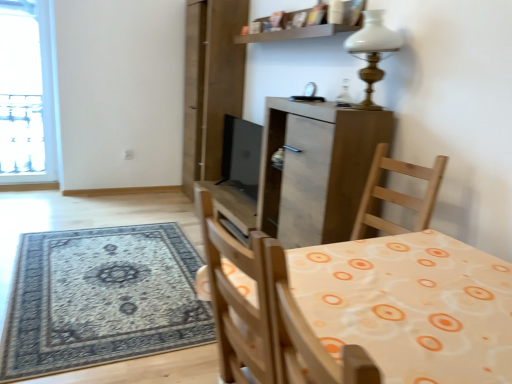
What do you see at coordinates (372, 51) in the screenshot? I see `white glass lamp at upper center` at bounding box center [372, 51].

I want to click on matte wood cabinet at center, so click(x=316, y=169).

This screenshot has height=384, width=512. Describe the element at coordinates (295, 33) in the screenshot. I see `wooden shelf at upper center` at that location.

Image resolution: width=512 pixels, height=384 pixels. I want to click on wooden table at center, so click(x=410, y=306).

In the scene shown: Is matte wood cabinet at center completely or partially outside of black matte screen door at upper center?

Yes, matte wood cabinet at center is located beyond the bounds of black matte screen door at upper center.

Would you say matte wood cabinet at center is to the left or to the right of black matte screen door at upper center in the picture?

From the image, it's evident that matte wood cabinet at center is to the right of black matte screen door at upper center.

Considering their positions, is matte wood cabinet at center located in front of or behind black matte screen door at upper center?

Visually, matte wood cabinet at center is located in front of black matte screen door at upper center.

Considering the relative sizes of matte wood cabinet at center and black matte screen door at upper center in the image provided, is matte wood cabinet at center taller than black matte screen door at upper center?

In fact, matte wood cabinet at center may be shorter than black matte screen door at upper center.

From the image's perspective, between wooden shelf at upper center and matte wood cabinet at center, which one is located above?

wooden shelf at upper center appears higher in the image.

Is wooden shelf at upper center turned away from matte wood cabinet at center?

wooden shelf at upper center does not have its back to matte wood cabinet at center.

Considering the relative sizes of wooden shelf at upper center and matte wood cabinet at center in the image provided, is wooden shelf at upper center bigger than matte wood cabinet at center?

No.

Does point (278, 31) come closer to viewer compared to point (342, 192)?

No, it is not.

Can you confirm if black matte screen door at upper center is thinner than wooden table at center?

Indeed, black matte screen door at upper center has a lesser width compared to wooden table at center.

Does black matte screen door at upper center turn towards wooden table at center?

No, black matte screen door at upper center is not turned towards wooden table at center.

Which object is further away from the camera, black matte screen door at upper center or wooden table at center?

black matte screen door at upper center is further away from the camera.

Is black matte screen door at upper center to the left of wooden table at center from the viewer's perspective?

Correct, you'll find black matte screen door at upper center to the left of wooden table at center.

What's the angular difference between matte wood cabinet at center and wooden table at center's facing directions?

matte wood cabinet at center and wooden table at center are facing 178 degrees away from each other.

Which object is further away from the camera taking this photo, matte wood cabinet at center or wooden table at center?

matte wood cabinet at center is further away from the camera.

From a real-world perspective, is matte wood cabinet at center positioned over wooden table at center based on gravity?

No.

Which of these two, matte wood cabinet at center or wooden table at center, is bigger?

With larger size is matte wood cabinet at center.

Looking at this image, how many degrees apart are the facing directions of black matte screen door at upper center and matte wood cabinet at center?

There is a 0.000172-degree angle between the facing directions of black matte screen door at upper center and matte wood cabinet at center.

Consider the image. Is black matte screen door at upper center not near matte wood cabinet at center?

Yes, black matte screen door at upper center and matte wood cabinet at center are quite far apart.

Is black matte screen door at upper center shorter than matte wood cabinet at center?

No, black matte screen door at upper center is not shorter than matte wood cabinet at center.

Considering the positions of objects black matte screen door at upper center and matte wood cabinet at center in the image provided, who is more to the left, black matte screen door at upper center or matte wood cabinet at center?

From the viewer's perspective, black matte screen door at upper center appears more on the left side.

Does wooden table at center turn towards black matte screen door at upper center?

No.

Where is `screen door above the wooden table at center (from a real-world perspective)`? This screenshot has width=512, height=384. screen door above the wooden table at center (from a real-world perspective) is located at coordinates (211, 84).

From the image's perspective, is wooden table at center located beneath black matte screen door at upper center?

Yes, from the image's perspective, wooden table at center is below black matte screen door at upper center.

Which object is wider, wooden table at center or black matte screen door at upper center?

wooden table at center is wider.

Does white glass lamp at upper center have a lesser height compared to wooden table at center?

Yes.

Which is in front, white glass lamp at upper center or wooden table at center?

Positioned in front is wooden table at center.

Is white glass lamp at upper center at the right side of wooden table at center?

Yes.

Between white glass lamp at upper center and wooden table at center, which one has smaller size?

Smaller between the two is white glass lamp at upper center.

The height and width of the screenshot is (384, 512). I want to click on cabinetry below the black matte screen door at upper center (from a real-world perspective), so click(316, 169).

The image size is (512, 384). Identify the location of shelf that is above the matte wood cabinet at center (from the image's perspective). (295, 33).

Considering their positions, is black matte screen door at upper center positioned closer to white glass lamp at upper center than matte wood cabinet at center?

The object closer to white glass lamp at upper center is matte wood cabinet at center.

Which object lies further to the anchor point wooden table at center, wooden shelf at upper center or white glass lamp at upper center?

wooden shelf at upper center.

Based on their spatial positions, is wooden shelf at upper center or black matte screen door at upper center further from white glass lamp at upper center?

Based on the image, black matte screen door at upper center appears to be further to white glass lamp at upper center.

Estimate the real-world distances between objects in this image. Which object is closer to wooden shelf at upper center, black matte screen door at upper center or white glass lamp at upper center?

white glass lamp at upper center.

Which object lies nearer to the anchor point wooden table at center, white glass lamp at upper center or matte wood cabinet at center?

matte wood cabinet at center is positioned closer to the anchor wooden table at center.

From the image, which object appears to be farther from black matte screen door at upper center, white glass lamp at upper center or wooden shelf at upper center?

The object further to black matte screen door at upper center is white glass lamp at upper center.

Looking at the image, which one is located closer to wooden shelf at upper center, black matte screen door at upper center or wooden table at center?

black matte screen door at upper center.

Estimate the real-world distances between objects in this image. Which object is further from white glass lamp at upper center, wooden shelf at upper center or wooden table at center?

wooden table at center.

Find the location of a particular element. This screenshot has height=384, width=512. cabinetry positioned between wooden table at center and black matte screen door at upper center from near to far is located at coordinates (316, 169).

Where is `shelf between wooden table at center and black matte screen door at upper center from front to back`? shelf between wooden table at center and black matte screen door at upper center from front to back is located at coordinates (295, 33).

Locate an element on the screen. Image resolution: width=512 pixels, height=384 pixels. lamp between wooden table at center and matte wood cabinet at center along the z-axis is located at coordinates (372, 51).

Identify the location of lamp between wooden table at center and black matte screen door at upper center from front to back. (372, 51).